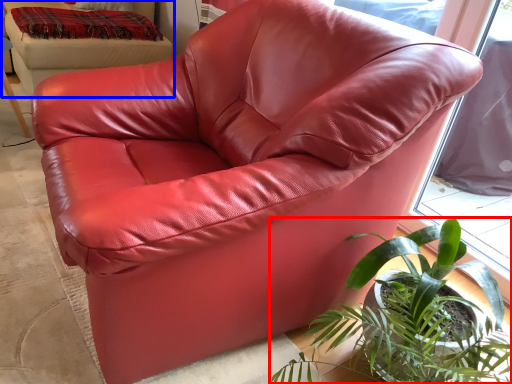
Question: Which of the following is the farthest to the observer, houseplant (highlighted by a red box) or bean bag chair (highlighted by a blue box)?

Choices:
 (A) houseplant
 (B) bean bag chair

Answer: (B)